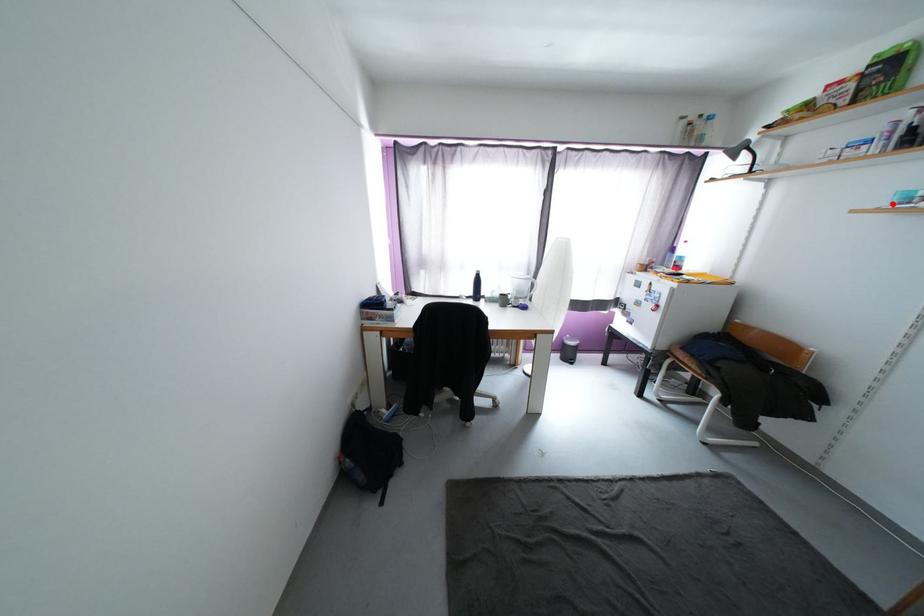
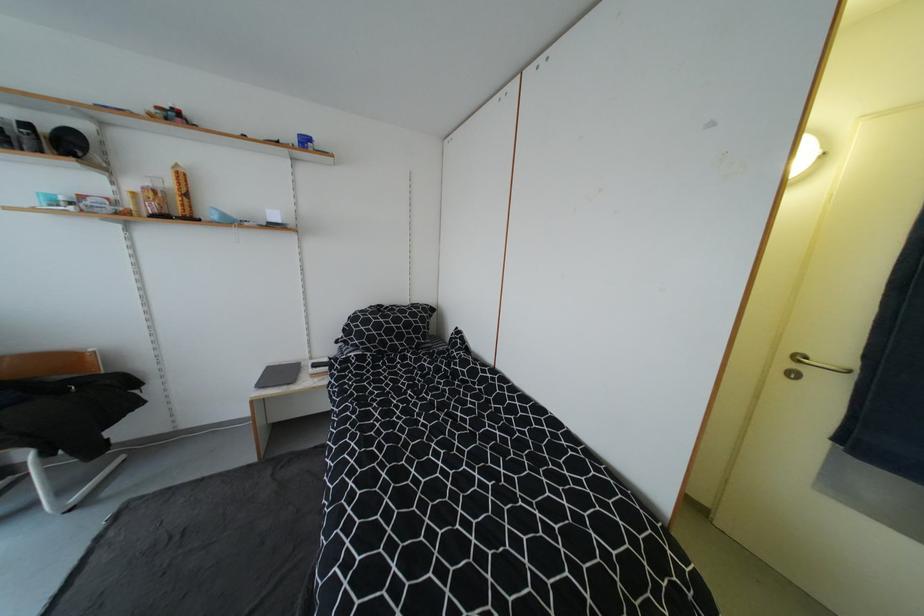
The point at the highlighted location is marked in the first image. Where is the corresponding point in the second image?

(43, 204)